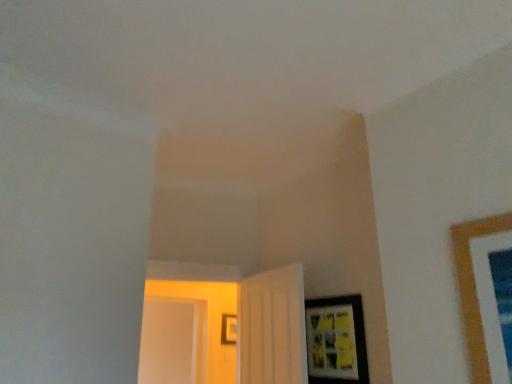
Question: Is transparent glass door at left in front of matte black picture frame at lower right, which is the 2th picture frame from bottom to top?

Choices:
 (A) no
 (B) yes

Answer: (A)

Question: Does transparent glass door at left come behind matte black picture frame at lower right, placed as the 1th picture frame when sorted from front to back?

Choices:
 (A) yes
 (B) no

Answer: (A)

Question: Would you say transparent glass door at left contains matte black picture frame at lower right, the 2th picture frame viewed from the left?

Choices:
 (A) no
 (B) yes

Answer: (A)

Question: Is transparent glass door at left taller than matte black picture frame at lower right, placed as the 1th picture frame when sorted from front to back?

Choices:
 (A) yes
 (B) no

Answer: (A)

Question: Is transparent glass door at left at the left side of matte black picture frame at lower right, which is the 2th picture frame from bottom to top?

Choices:
 (A) no
 (B) yes

Answer: (B)

Question: Is transparent glass door at left far away from matte black picture frame at lower right, the 2th picture frame viewed from the left?

Choices:
 (A) yes
 (B) no

Answer: (A)

Question: Can you confirm if matte black picture frame at center, arranged as the 1th picture frame when ordered from the bottom, is thinner than white matte door at center, the first door from the right?

Choices:
 (A) no
 (B) yes

Answer: (B)

Question: Does matte black picture frame at center, acting as the second picture frame starting from the right, have a greater height compared to white matte door at center, the second door in the left-to-right sequence?

Choices:
 (A) no
 (B) yes

Answer: (A)

Question: Is matte black picture frame at center, which ranks as the first picture frame in back-to-front order, outside of white matte door at center, the first door from the right?

Choices:
 (A) no
 (B) yes

Answer: (B)

Question: Is matte black picture frame at center, arranged as the 1th picture frame when ordered from the bottom, looking in the opposite direction of white matte door at center, the first door from the right?

Choices:
 (A) no
 (B) yes

Answer: (A)

Question: From the image's perspective, would you say matte black picture frame at center, which ranks as the first picture frame in back-to-front order, is positioned over white matte door at center, the first door from the right?

Choices:
 (A) no
 (B) yes

Answer: (A)

Question: Is matte black picture frame at center, which is the second picture frame from front to back, aimed at white matte door at center, the first door from the right?

Choices:
 (A) yes
 (B) no

Answer: (B)

Question: Does matte black picture frame at lower right, the 2th picture frame viewed from the left, have a greater height compared to white matte door at center, the second door in the left-to-right sequence?

Choices:
 (A) yes
 (B) no

Answer: (B)